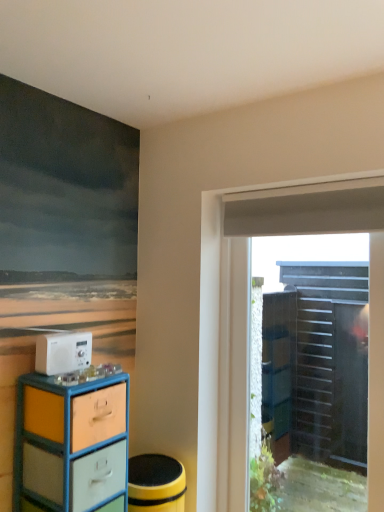
Where is `free space in front of white plastic radio at lower left`? free space in front of white plastic radio at lower left is located at coordinates (58, 380).